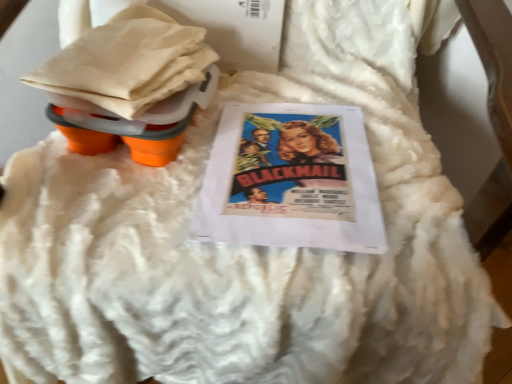
Question: Is matte paper movie poster at center positioned before orange rubberized cups at upper left?

Choices:
 (A) no
 (B) yes

Answer: (A)

Question: Is matte paper movie poster at center aimed at orange rubberized cups at upper left?

Choices:
 (A) no
 (B) yes

Answer: (A)

Question: Does matte paper movie poster at center lie behind orange rubberized cups at upper left?

Choices:
 (A) yes
 (B) no

Answer: (A)

Question: Is orange rubberized cups at upper left at the back of matte paper movie poster at center?

Choices:
 (A) no
 (B) yes

Answer: (A)

Question: From a real-world perspective, is matte paper movie poster at center on orange rubberized cups at upper left?

Choices:
 (A) no
 (B) yes

Answer: (A)

Question: Can you confirm if matte paper movie poster at center is thinner than orange rubberized cups at upper left?

Choices:
 (A) no
 (B) yes

Answer: (A)

Question: From a real-world perspective, does orange rubberized cups at upper left stand above matte paper movie poster at center?

Choices:
 (A) yes
 (B) no

Answer: (A)

Question: From a real-world perspective, is orange rubberized cups at upper left beneath matte paper movie poster at center?

Choices:
 (A) yes
 (B) no

Answer: (B)

Question: Is orange rubberized cups at upper left oriented towards matte paper movie poster at center?

Choices:
 (A) no
 (B) yes

Answer: (A)

Question: Is orange rubberized cups at upper left facing away from matte paper movie poster at center?

Choices:
 (A) no
 (B) yes

Answer: (A)

Question: Does orange rubberized cups at upper left come behind matte paper movie poster at center?

Choices:
 (A) yes
 (B) no

Answer: (B)

Question: Is orange rubberized cups at upper left in front of matte paper movie poster at center?

Choices:
 (A) no
 (B) yes

Answer: (B)

Question: Is matte paper movie poster at center wider or thinner than orange rubberized cups at upper left?

Choices:
 (A) wide
 (B) thin

Answer: (A)